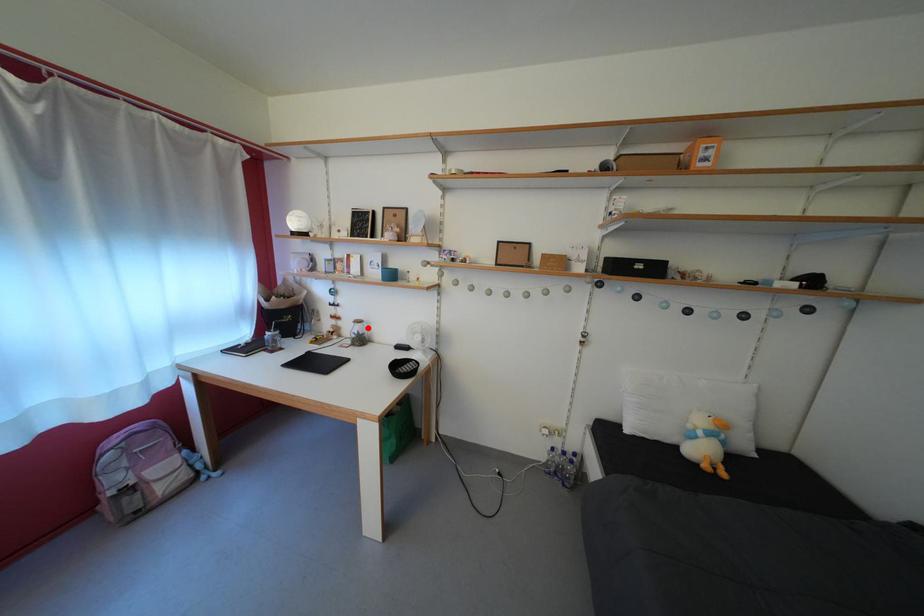
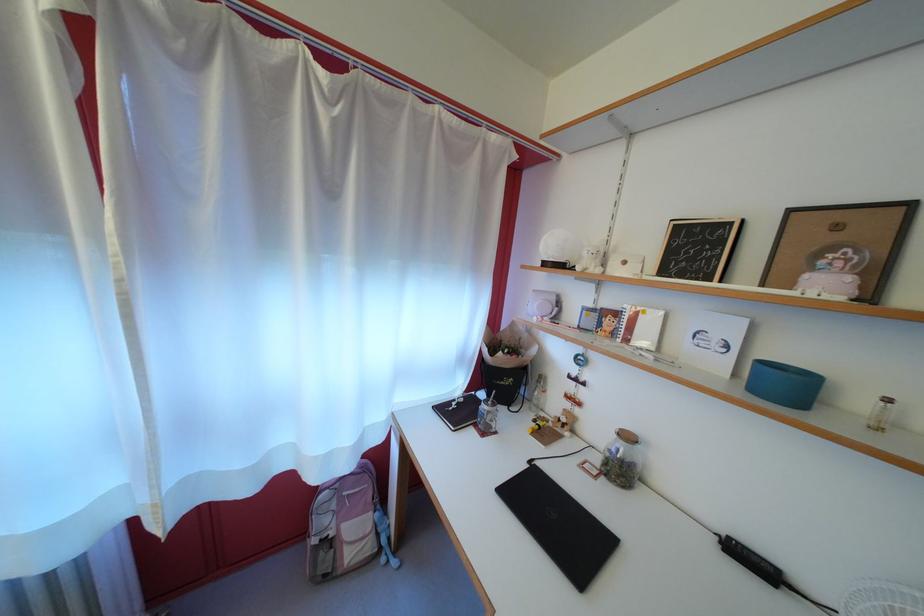
Find the pixel in the second image that matches the highlighted location in the first image.

(637, 444)